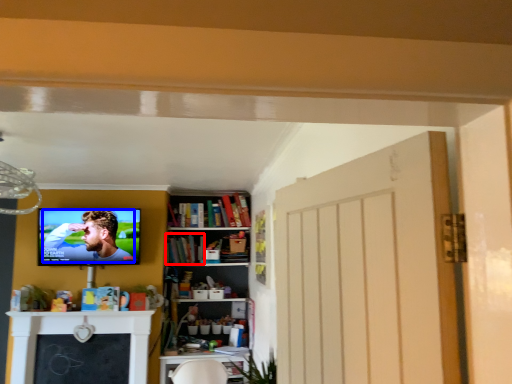
Question: Which of the following is the closest to the observer, book (highlighted by a red box) or person (highlighted by a blue box)?

Choices:
 (A) book
 (B) person

Answer: (B)